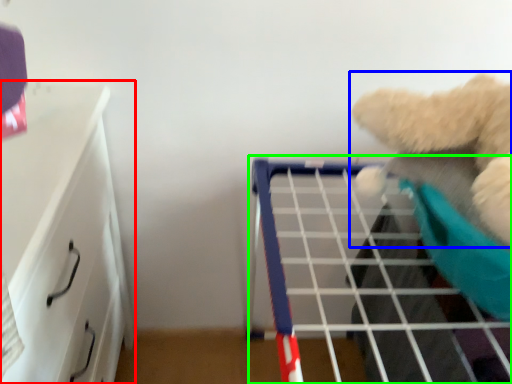
Question: Considering the real-world distances, which object is closest to furniture (highlighted by a red box)? teddy bear (highlighted by a blue box) or shelf (highlighted by a green box).

Choices:
 (A) teddy bear
 (B) shelf

Answer: (B)